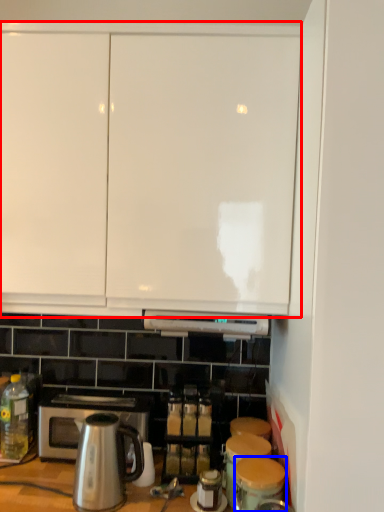
Question: Which object appears farthest to the camera in this image, cabinetry (highlighted by a red box) or appliance (highlighted by a blue box)?

Choices:
 (A) cabinetry
 (B) appliance

Answer: (A)